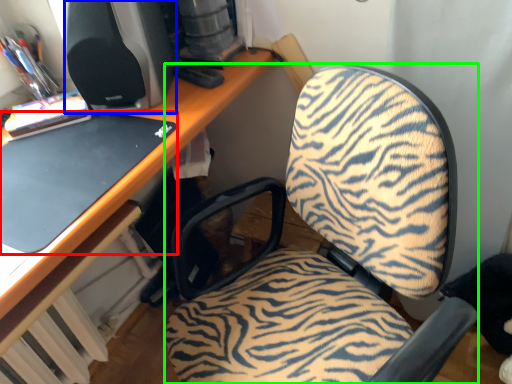
Question: Which object is the closest to the laptop (highlighted by a red box)? Choose among these: desktop computer (highlighted by a blue box) or furniture (highlighted by a green box).

Choices:
 (A) desktop computer
 (B) furniture

Answer: (A)